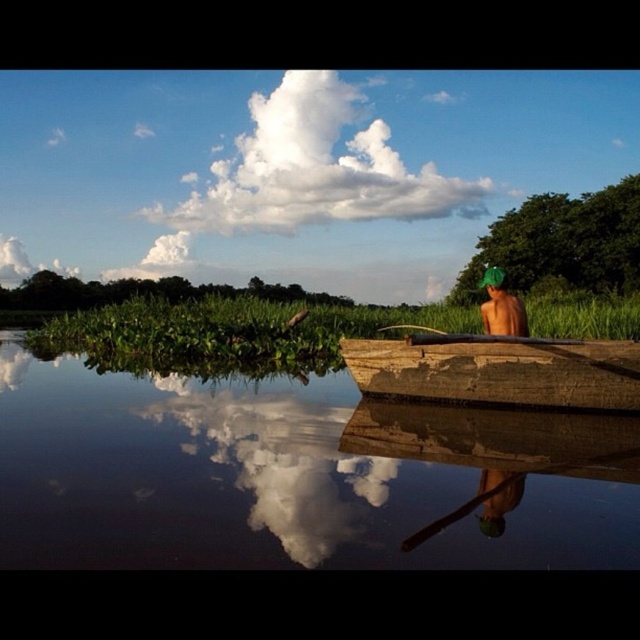
You are a photographer trying to capture the reflection of the smooth brown water at center and the rusty wood boat at right. Which object will appear smaller in your photo?

The smooth brown water at center will appear smaller in the photo because it is shorter than the rusty wood boat at right.

You are a photographer trying to capture the reflection of the white fluffy cloud at upper center in the smooth brown water at center. How far apart are the actual cloud and its reflection in the water?

The distance between the white fluffy cloud at upper center and its reflection in the smooth brown water at center is 64.56 meters.